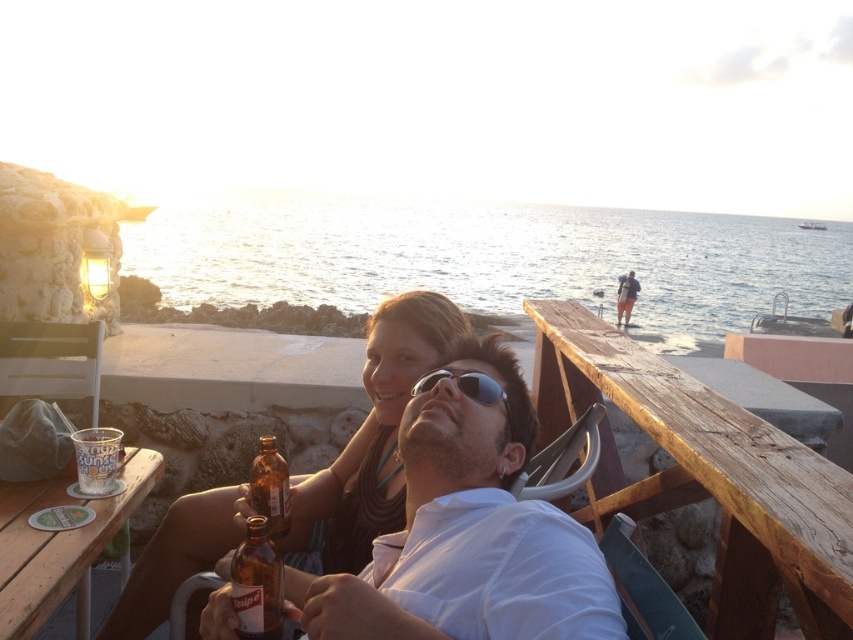
Is point (625, 518) positioned before point (538, 470)?

Yes, it is in front of point (538, 470).

Who is more forward, [703,637] or [535,468]?

Point [703,637]

Where is `wooden textured beach chair at lower right`? This screenshot has height=640, width=853. wooden textured beach chair at lower right is located at coordinates (643, 588).

Is brown glass bottle at center smaller than sunglasses at center?

Actually, brown glass bottle at center might be larger than sunglasses at center.

The width and height of the screenshot is (853, 640). Find the location of `brown glass bottle at center`. brown glass bottle at center is located at coordinates (270, 486).

The width and height of the screenshot is (853, 640). What are the coordinates of `brown glass bottle at center` in the screenshot? It's located at (270, 486).

Is clear plastic cup at table left to the left of sunglasses at center from the viewer's perspective?

Yes, clear plastic cup at table left is to the left of sunglasses at center.

Image resolution: width=853 pixels, height=640 pixels. In order to click on clear plastic cup at table left in this screenshot , I will do `click(96, 458)`.

Is point (91, 476) behind point (457, 378)?

Yes, point (91, 476) is farther from viewer.

At what (x,y) coordinates should I click in order to perform the action: click on clear plastic cup at table left. Please return your answer as a coordinate pair (x, y). The image size is (853, 640). Looking at the image, I should click on (96, 458).